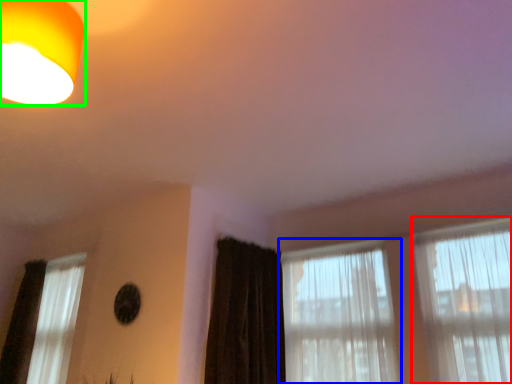
Question: Based on their relative distances, which object is farther from window (highlighted by a red box)? Choose from window (highlighted by a blue box) and lamp (highlighted by a green box).

Choices:
 (A) window
 (B) lamp

Answer: (B)